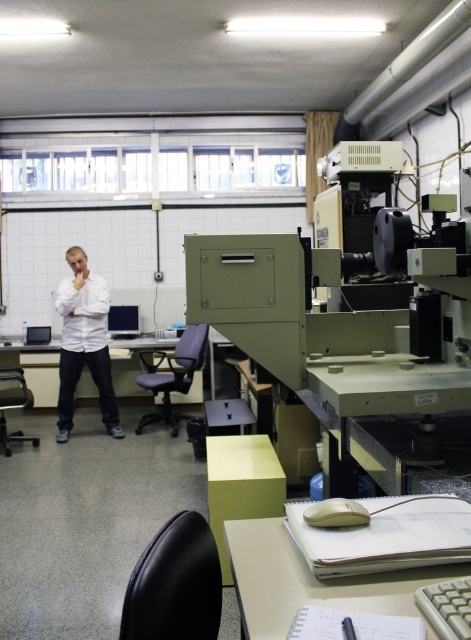
Is white matte shirt at center shorter than matte white table at left?

In fact, white matte shirt at center may be taller than matte white table at left.

Does point (66, 397) come closer to viewer compared to point (113, 365)?

Yes, it is.

Where is `white matte shirt at center`? white matte shirt at center is located at coordinates (83, 342).

Who is more distant from viewer, (381, 595) or (78, 369)?

Point (78, 369)

Is matte plastic table at lower center positioned in front of white matte shirt at center?

That is True.

Is point (265, 609) closer to camera compared to point (89, 333)?

That is True.

I want to click on matte plastic table at lower center, so click(x=309, y=580).

Which is more to the left, matte white table at left or matte black monitor at center?

matte black monitor at center is more to the left.

Between matte white table at left and matte black monitor at center, which one is positioned lower?

Positioned lower is matte white table at left.

Is point (96, 394) positioned before point (129, 333)?

No, (96, 394) is further to viewer.

Where is `matte white table at left`? The width and height of the screenshot is (471, 640). matte white table at left is located at coordinates (40, 374).